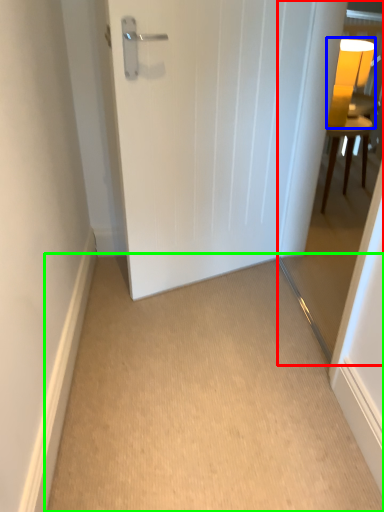
Question: Which is nearer to the glass door (highlighted by a red box)? table lamp (highlighted by a blue box) or corridor (highlighted by a green box).

Choices:
 (A) table lamp
 (B) corridor

Answer: (A)